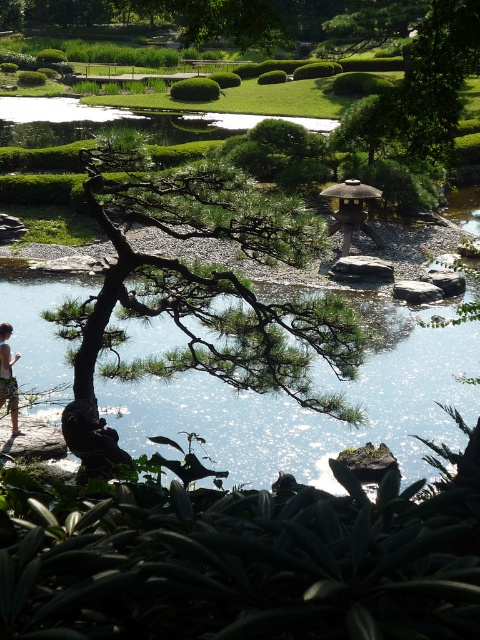
You are standing in the Japanese garden and want to walk from the twisted tree trunk to the water surface. You see two points marked in the scene. The first point is at coordinate point(201, 218) and the second is at point(3, 336). Which point should you step on first to reach the water surface efficiently?

You should step on point(201, 218) first because it is in front of point(3, 336), so it is closer to your starting position at the twisted tree trunk.

You are designing a miniature model of this garden and want to place a small statue between the green matte tree at center and the clear water at center. Given their sizes, which object should the statue be closer to?

The green matte tree at center has a larger width than the clear water at center, so the statue should be placed closer to the clear water at center to maintain balance between the two objects.